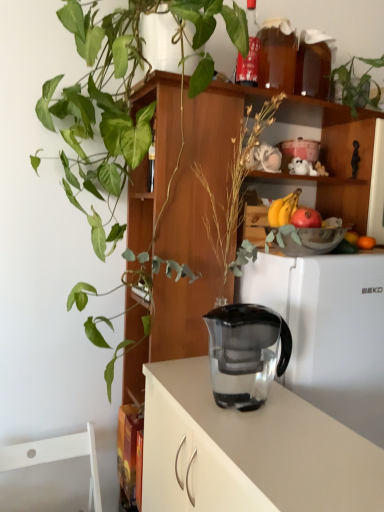
At what (x,y) coordinates should I click in order to perform the action: click on red matte apple at upper right. Please return your answer as a coordinate pair (x, y). Image resolution: width=384 pixels, height=512 pixels. Looking at the image, I should click on (306, 218).

Measure the distance between point (366, 98) and camera.

Point (366, 98) is 1.59 meters from camera.

How much space does green leafy plant at upper right, acting as the first houseplant starting from the right, occupy horizontally?

The width of green leafy plant at upper right, acting as the first houseplant starting from the right, is 10.22 inches.

The width and height of the screenshot is (384, 512). What do you see at coordinates (249, 51) in the screenshot? I see `matte glass bottle at upper center` at bounding box center [249, 51].

Where is `transparent glass pitcher at center`? transparent glass pitcher at center is located at coordinates (249, 450).

Locate an element on the screen. The image size is (384, 512). white matte refrigerator at center is located at coordinates (328, 330).

Where is `green glossy plant at upper left, arranged as the second houseplant when viewed from the right`? green glossy plant at upper left, arranged as the second houseplant when viewed from the right is located at coordinates (124, 95).

You are a GUI agent. You are given a task and a screenshot of the screen. Output one action in this format:
    pyautogui.click(x=<x>, y=<y>)
    Task: Click on the red matte apple at upper right
    The width and height of the screenshot is (384, 512).
    Given the screenshot: What is the action you would take?
    pyautogui.click(x=306, y=218)

From a real-world perspective, which houseplant is the 2nd one above the transparent glass pitcher at center? Please provide its 2D coordinates.

[(356, 84)]

Can you confirm if green leafy plant at upper right, acting as the first houseplant starting from the right, is bigger than transparent glass pitcher at center?

No.

From the image's perspective, between green leafy plant at upper right, acting as the first houseplant starting from the right, and transparent glass pitcher at center, who is located below?

transparent glass pitcher at center appears lower in the image.

Is green leafy plant at upper right, the 2th houseplant positioned from the left, to the left of transparent glass pitcher at center from the viewer's perspective?

No, green leafy plant at upper right, the 2th houseplant positioned from the left, is not to the left of transparent glass pitcher at center.

Consider the image. Is transparent glass pitcher at center spatially inside transparent glass vase at center, or outside of it?

transparent glass pitcher at center is not enclosed by transparent glass vase at center.

From their relative heights in the image, would you say transparent glass pitcher at center is taller or shorter than transparent glass vase at center?

Clearly, transparent glass pitcher at center is shorter compared to transparent glass vase at center.

Between point (198, 466) and point (367, 118), which one is positioned in front?

The point (198, 466) is closer.

How distant is transparent glass pitcher at center from transparent glass vase at center?

They are 16.85 inches apart.

Is yellow matte bananas at upper right bigger than transparent glass pitcher at center?

Incorrect, yellow matte bananas at upper right is not larger than transparent glass pitcher at center.

From the image's perspective, is yellow matte bananas at upper right under transparent glass pitcher at center?

No, from the image's perspective, yellow matte bananas at upper right is not beneath transparent glass pitcher at center.

Do you think yellow matte bananas at upper right is within transparent glass pitcher at center, or outside of it?

yellow matte bananas at upper right cannot be found inside transparent glass pitcher at center.

Which object is closer to the camera, yellow matte bananas at upper right or transparent glass pitcher at center?

transparent glass pitcher at center is closer to the camera.

Which of these two, matte glass bottle at upper center or transparent glass vase at center, is bigger?

transparent glass vase at center is bigger.

Considering their positions, is matte glass bottle at upper center located in front of or behind transparent glass vase at center?

matte glass bottle at upper center is behind transparent glass vase at center.

From the image's perspective, is matte glass bottle at upper center above or below transparent glass vase at center?

matte glass bottle at upper center is above transparent glass vase at center.

The height and width of the screenshot is (512, 384). I want to click on shelf below the matte glass bottle at upper center (from the image's perspective), so click(191, 231).

Does point (283, 216) come behind point (346, 73)?

No.

Is yellow matte bananas at upper right facing away from green leafy plant at upper right, acting as the first houseplant starting from the right?

No, yellow matte bananas at upper right's orientation is not away from green leafy plant at upper right, acting as the first houseplant starting from the right.

From a real-world perspective, relative to green leafy plant at upper right, the 2th houseplant positioned from the left, is yellow matte bananas at upper right vertically above or below?

Clearly, from a real-world perspective, yellow matte bananas at upper right is below green leafy plant at upper right, the 2th houseplant positioned from the left.

Considering the sizes of objects yellow matte bananas at upper right and green leafy plant at upper right, acting as the first houseplant starting from the right, in the image provided, who is shorter, yellow matte bananas at upper right or green leafy plant at upper right, acting as the first houseplant starting from the right,?

With less height is yellow matte bananas at upper right.

From the image's perspective, is white matte refrigerator at center on transparent plastic jug at center?

No, from the image's perspective, white matte refrigerator at center is not over transparent plastic jug at center.

Is point (376, 288) positioned after point (249, 348)?

Yes, it is.

Is white matte refrigerator at center not within transparent plastic jug at center?

Absolutely, white matte refrigerator at center is external to transparent plastic jug at center.

From a real-world perspective, which is physically below, white matte refrigerator at center or transparent plastic jug at center?

In real-world perspective, white matte refrigerator at center is lower.

Is point (118, 195) farther from viewer compared to point (173, 184)?

Yes.

Based on the photo, choose the correct answer: Is green glossy plant at upper left, arranged as the second houseplant when viewed from the right, inside transparent glass vase at center or outside it?

The correct answer is: outside.

Could you tell me if green glossy plant at upper left, the first houseplant viewed from the left, is facing transparent glass vase at center?

Yes, green glossy plant at upper left, the first houseplant viewed from the left, is oriented towards transparent glass vase at center.

Locate an element on the screen. cabinetry beneath the green leafy plant at upper right, the 2th houseplant positioned from the left (from a real-world perspective) is located at coordinates (249, 450).

At what (x,y) coordinates should I click in order to perform the action: click on shelf that appears above the transparent glass pitcher at center (from a real-world perspective). Please return your answer as a coordinate pair (x, y). The image size is (384, 512). Looking at the image, I should click on (191, 231).

Looking at the image, which one is located further to red matte apple at upper right, white matte refrigerator at center or matte glass bottle at upper center?

matte glass bottle at upper center is further to red matte apple at upper right.

Estimate the real-world distances between objects in this image. Which object is further from transparent plastic jug at center, matte glass bottle at upper center or transparent glass pitcher at center?

matte glass bottle at upper center lies further to transparent plastic jug at center than the other object.

Based on their spatial positions, is white matte refrigerator at center or red matte apple at upper right further from transparent plastic jug at center?

The object further to transparent plastic jug at center is red matte apple at upper right.

Which object lies further to the anchor point transparent glass vase at center, transparent plastic jug at center or yellow matte bananas at upper right?

A: yellow matte bananas at upper right lies further to transparent glass vase at center than the other object.

Considering their positions, is matte glass bottle at upper center positioned closer to yellow matte bananas at upper right than red matte apple at upper right?

red matte apple at upper right.

When comparing their distances from white matte refrigerator at center, does matte glass bottle at upper center or red matte apple at upper right seem further?

Based on the image, matte glass bottle at upper center appears to be further to white matte refrigerator at center.

From the picture: Based on their spatial positions, is matte glass bottle at upper center or red matte apple at upper right further from green glossy plant at upper left, arranged as the second houseplant when viewed from the right?

red matte apple at upper right is positioned further to the anchor green glossy plant at upper left, arranged as the second houseplant when viewed from the right.

From the image, which object appears to be nearer to white matte refrigerator at center, matte glass bottle at upper center or yellow matte bananas at upper right?

The object closer to white matte refrigerator at center is yellow matte bananas at upper right.

This screenshot has width=384, height=512. Find the location of `shelf between green leafy plant at upper right, the 2th houseplant positioned from the left, and transparent glass pitcher at center in the up-down direction`. shelf between green leafy plant at upper right, the 2th houseplant positioned from the left, and transparent glass pitcher at center in the up-down direction is located at coordinates (191, 231).

Identify the location of fruit between green leafy plant at upper right, the 2th houseplant positioned from the left, and transparent glass vase at center from top to bottom. (283, 209).

Image resolution: width=384 pixels, height=512 pixels. I want to click on refrigerator between matte glass bottle at upper center and transparent glass pitcher at center vertically, so tap(328, 330).

Where is `fruit between green leafy plant at upper right, acting as the first houseplant starting from the right, and transparent glass pitcher at center vertically`? This screenshot has height=512, width=384. fruit between green leafy plant at upper right, acting as the first houseplant starting from the right, and transparent glass pitcher at center vertically is located at coordinates (283, 209).